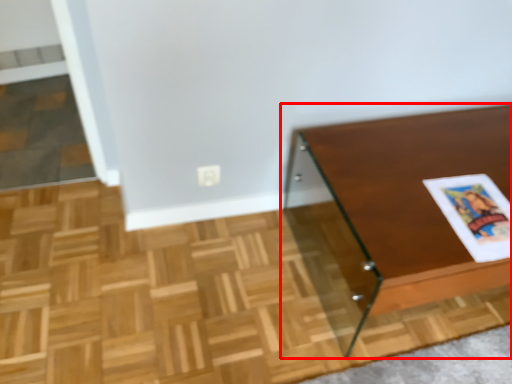
Question: In this image, where is table (annotated by the red box) located relative to magazine?

Choices:
 (A) left
 (B) right

Answer: (B)